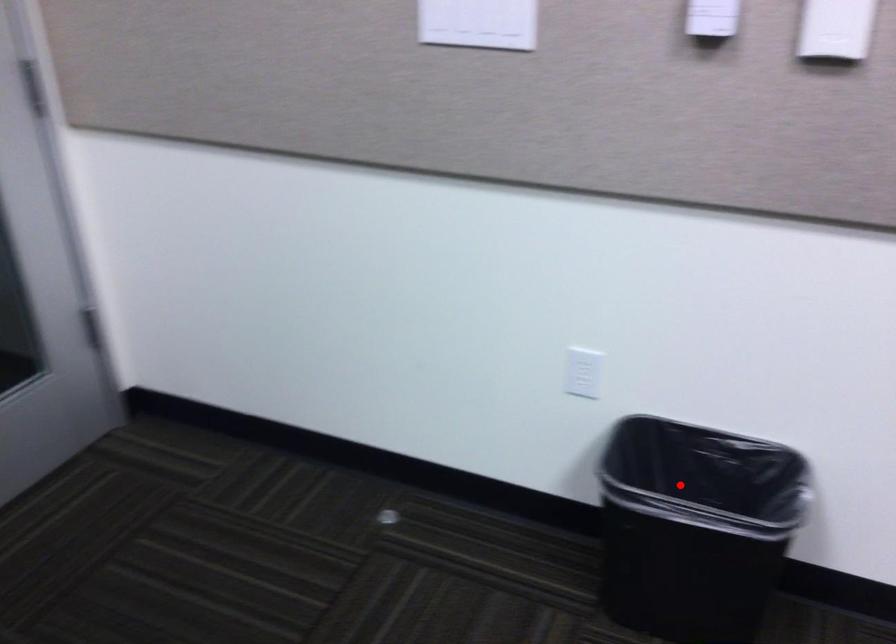
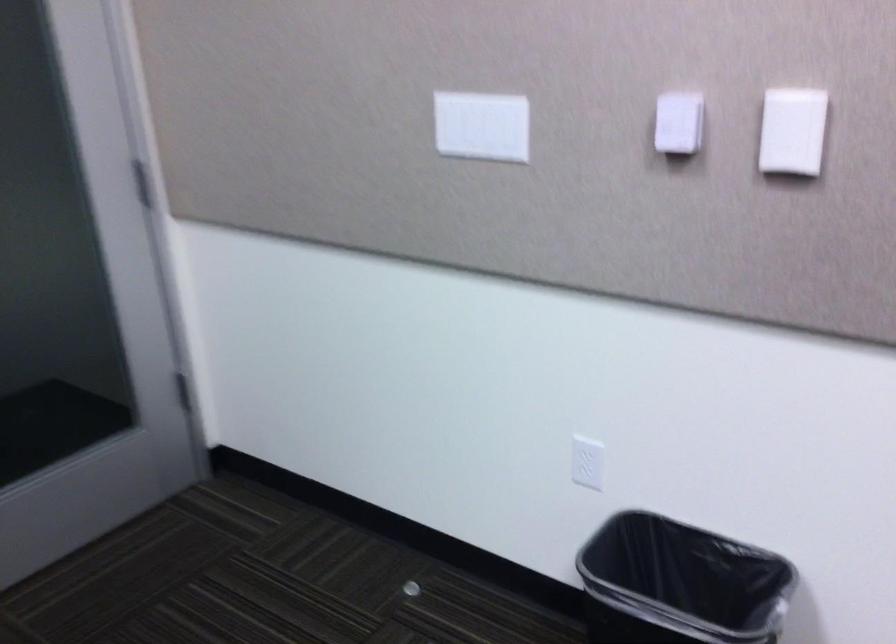
Where in the second image is the point corresponding to the highlighted location from the first image?

(679, 583)